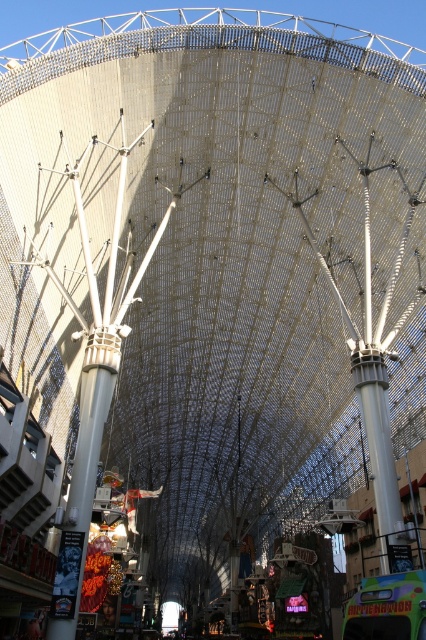
Question: Which of the following is the closest to the observer?

Choices:
 (A) white glossy pillar at center
 (B) white metallic pillar at center

Answer: (B)

Question: Is white metallic pillar at center below white glossy pillar at center?

Choices:
 (A) no
 (B) yes

Answer: (B)

Question: Which point is farther to the camera?

Choices:
 (A) (69, 509)
 (B) (388, 419)

Answer: (B)

Question: Is white metallic pillar at center closer to the viewer compared to white glossy pillar at center?

Choices:
 (A) yes
 (B) no

Answer: (A)

Question: Does white metallic pillar at center have a lesser width compared to white glossy pillar at center?

Choices:
 (A) no
 (B) yes

Answer: (A)